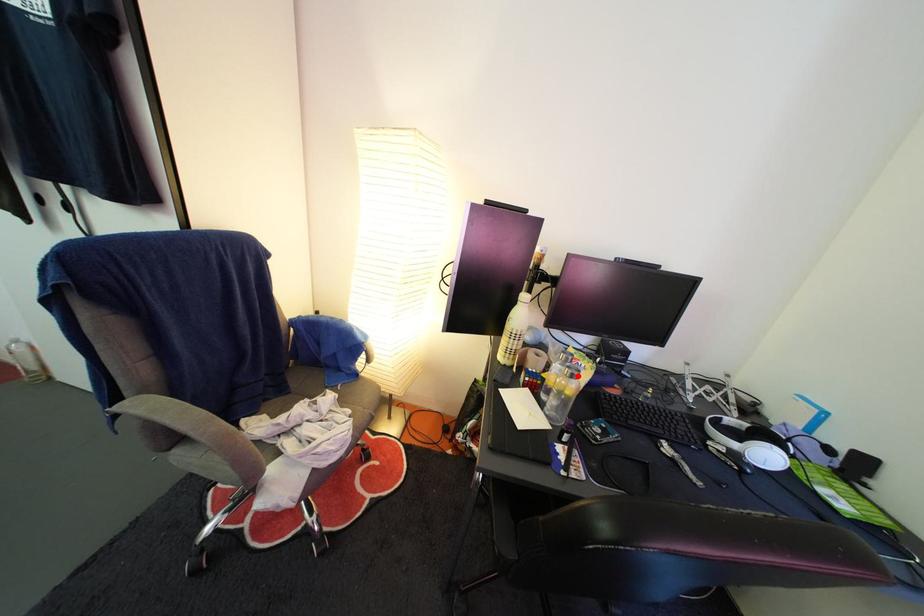
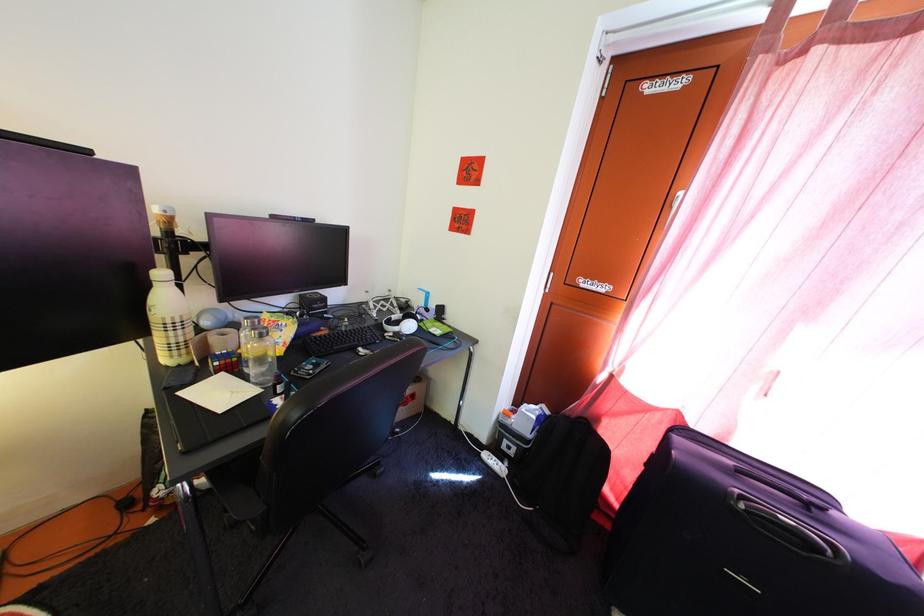
In the second image, find the point that corresponds to the highlighted location in the first image.

(262, 338)